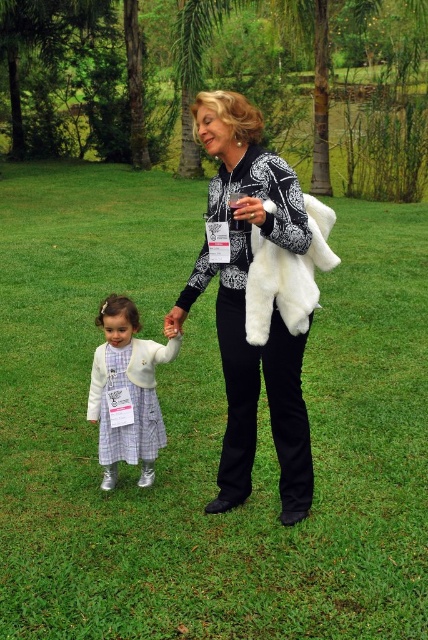
Does white furry coat at center appear on the right side of plaid fabric dress at center?

Indeed, white furry coat at center is positioned on the right side of plaid fabric dress at center.

At what (x,y) coordinates should I click in order to perform the action: click on white furry coat at center. Please return your answer as a coordinate pair (x, y). The height and width of the screenshot is (640, 428). Looking at the image, I should click on (265, 244).

You are a GUI agent. You are given a task and a screenshot of the screen. Output one action in this format:
    pyautogui.click(x=<x>, y=<y>)
    Task: Click on the white furry coat at center
    This screenshot has height=640, width=428.
    Given the screenshot: What is the action you would take?
    pyautogui.click(x=265, y=244)

Can you confirm if white fur coat at center is wider than white furry coat at center?

Incorrect, white fur coat at center's width does not surpass white furry coat at center's.

Which is behind, point (287, 348) or point (264, 316)?

Positioned behind is point (287, 348).

Describe the element at coordinates (243, 301) in the screenshot. I see `white fur coat at center` at that location.

Find the location of `white fur coat at center`. white fur coat at center is located at coordinates (243, 301).

Is the position of white furry coat at center less distant than that of white fluffy fur coat at center?

Yes.

Who is more forward, (222, 276) or (250, 305)?

Positioned in front is point (250, 305).

At what (x,y) coordinates should I click in order to perform the action: click on white furry coat at center. Please return your answer as a coordinate pair (x, y). The width and height of the screenshot is (428, 640). Looking at the image, I should click on (265, 244).